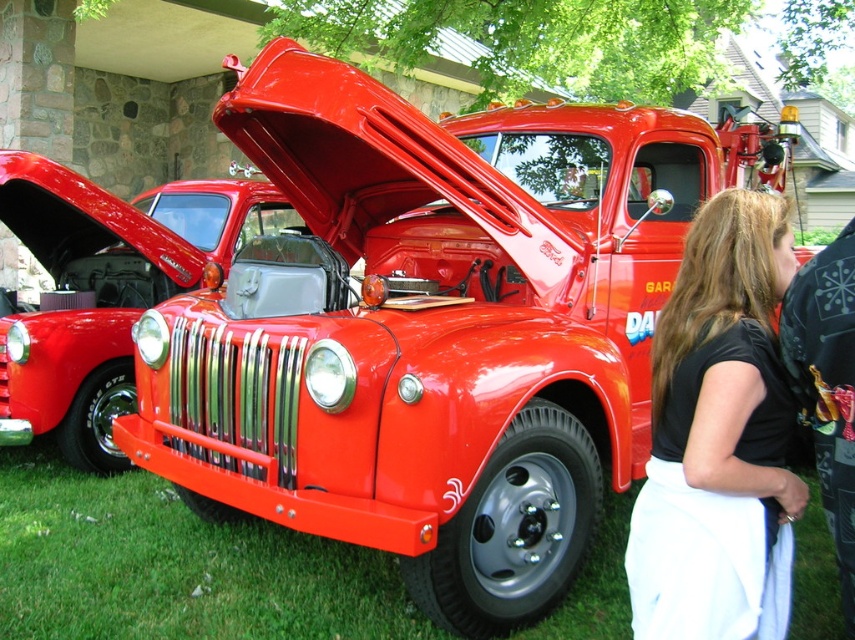
You are standing in the grassy area near the tow truck and want to place a picnic blanket. The picnic blanket is the same size as the black fabric skirt at lower right. Will the green grass at lower left have enough space to accommodate the picnic blanket?

The green grass at lower left is bigger than the black fabric skirt at lower right. Since the picnic blanket is the same size as the black fabric skirt at lower right, the green grass at lower left has enough space to accommodate the picnic blanket.